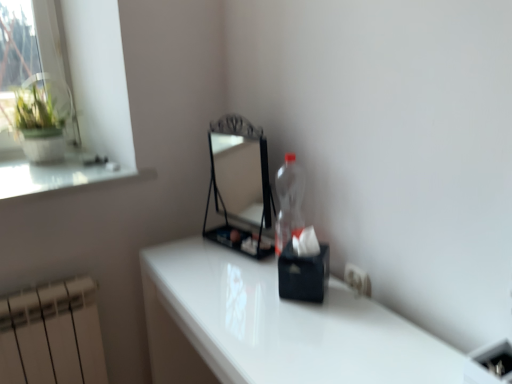
Question: Is white plastic electric outlet at lower right smaller than white glossy table at center?

Choices:
 (A) yes
 (B) no

Answer: (A)

Question: Considering the relative sizes of white plastic electric outlet at lower right and white glossy table at center in the image provided, is white plastic electric outlet at lower right thinner than white glossy table at center?

Choices:
 (A) no
 (B) yes

Answer: (B)

Question: Does white plastic electric outlet at lower right lie behind white glossy table at center?

Choices:
 (A) no
 (B) yes

Answer: (B)

Question: Is white plastic electric outlet at lower right to the left of white glossy table at center from the viewer's perspective?

Choices:
 (A) no
 (B) yes

Answer: (A)

Question: From a real-world perspective, is white plastic electric outlet at lower right over white glossy table at center?

Choices:
 (A) no
 (B) yes

Answer: (B)

Question: Is white plastic electric outlet at lower right bigger than white glossy table at center?

Choices:
 (A) yes
 (B) no

Answer: (B)

Question: From the image's perspective, is metallic black mirror at center above white glossy table at center?

Choices:
 (A) yes
 (B) no

Answer: (A)

Question: From a real-world perspective, is metallic black mirror at center physically above white glossy table at center?

Choices:
 (A) no
 (B) yes

Answer: (B)

Question: From a real-world perspective, is metallic black mirror at center under white glossy table at center?

Choices:
 (A) no
 (B) yes

Answer: (A)

Question: Is metallic black mirror at center outside white glossy table at center?

Choices:
 (A) yes
 (B) no

Answer: (A)

Question: Is metallic black mirror at center at the left side of white glossy table at center?

Choices:
 (A) no
 (B) yes

Answer: (B)

Question: Is metallic black mirror at center positioned in front of white glossy table at center?

Choices:
 (A) yes
 (B) no

Answer: (B)

Question: Is metallic black mirror at center beside white plastic electric outlet at lower right?

Choices:
 (A) no
 (B) yes

Answer: (A)